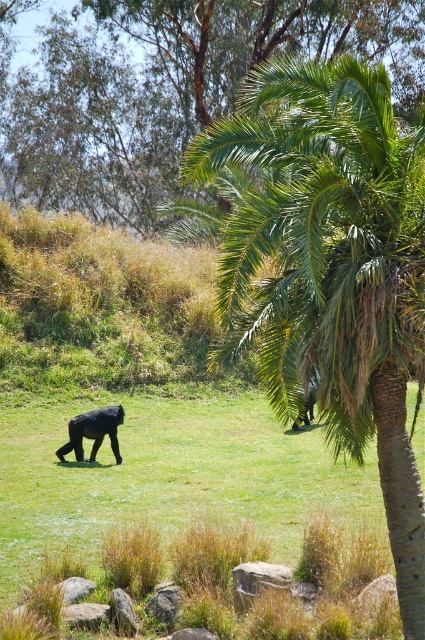
You are standing at the point with coordinates [331,268] in the scene. Based on the description, what object are you currently standing on?

The point [331,268] is on the green leafy palm tree at center, so you are standing on the green leafy palm tree at center.

You are a photographer standing in the grassy area. You want to take a photo of the green leafy palm tree at center without the green leafy palm at upper center blocking it. Is this possible?

The green leafy palm tree at center is positioned under the green leafy palm at upper center, so if you are standing in the grassy area, the upper palm will block the view of the lower palm tree. Therefore, it is not possible to take a photo of the green leafy palm tree at center without the green leafy palm at upper center blocking it.

You are a photographer standing at the edge of the grassy area. You want to take a photo of both the green leafy palm tree at center and the shiny black gorilla at center. Given that your camera has a maximum focus range of 15 feet, will you be able to capture both subjects in sharp focus?

The green leafy palm tree at center is 18.08 feet away from the shiny black gorilla at center. Since the distance between them exceeds the camera maximum focus range of 15 feet, you will not be able to capture both subjects in sharp focus.